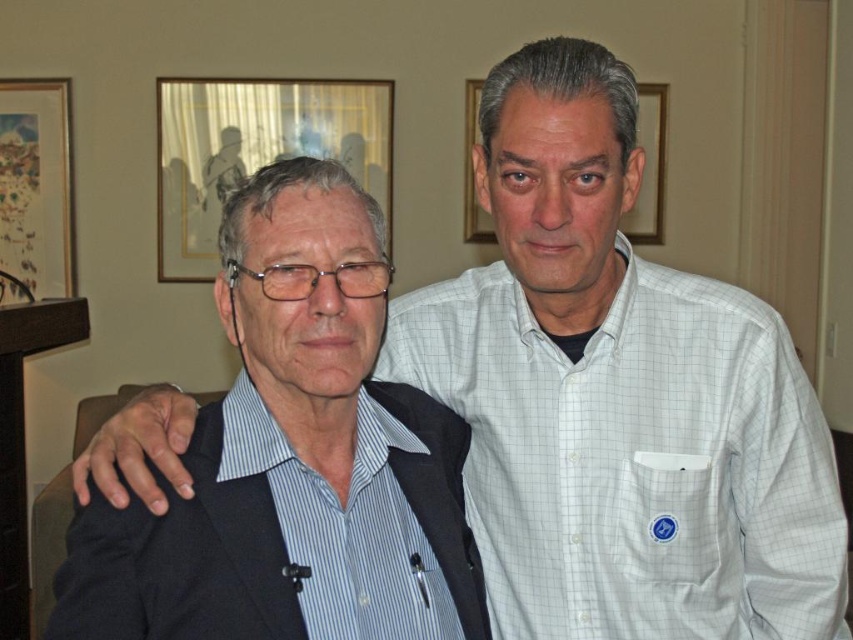
From the picture: Based on the coordinates provided, which object corresponds to the point at (293, 464)?

The point at (293, 464) corresponds to the blue striped shirt at left.

You are standing in the room and want to take a photo of the point at coordinates point [256,147]. If you are currently 4 meters away from it, should you move closer or farther away to get it into focus?

The distance of point [256,147] from camera is 3.91 meters, so you should move slightly closer to reach the exact distance for focus.

You are taking a photo of the scene described. You want to ensure that the point at coordinates point (270, 184) is in focus. What is the minimum distance you need to set your camera focus to capture this point clearly?

The point at coordinates point (270, 184) is 35.62 inches from the camera. To ensure it is in focus, the camera should be set to a focus distance of at least 35.62 inches.